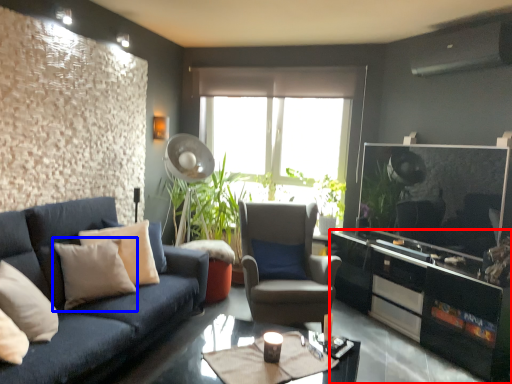
Question: Which point is closer to the camera, cabinetry (highlighted by a red box) or pillow (highlighted by a blue box)?

Choices:
 (A) cabinetry
 (B) pillow

Answer: (B)